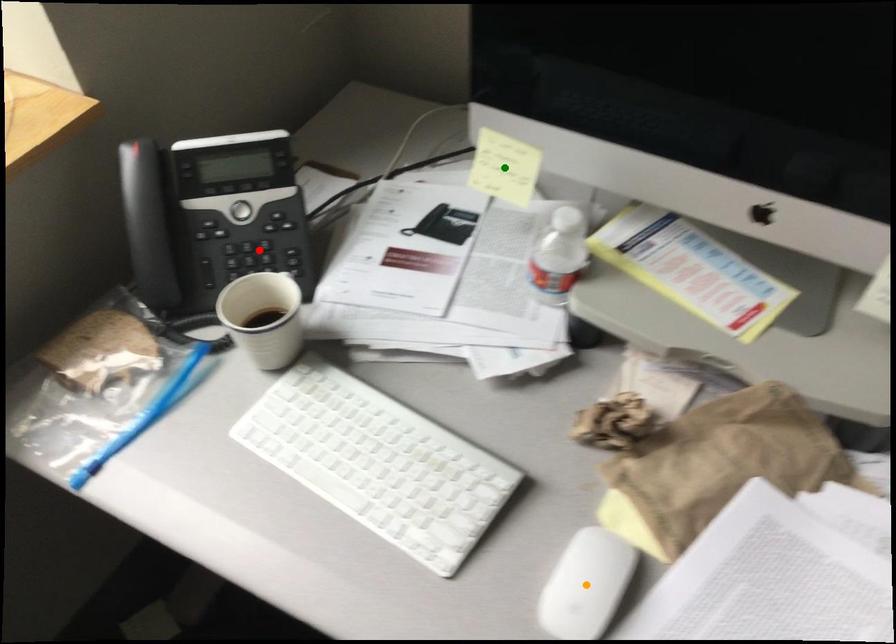
In the scene shown: Order these from nearest to farthest:
orange point | red point | green point

orange point < green point < red point